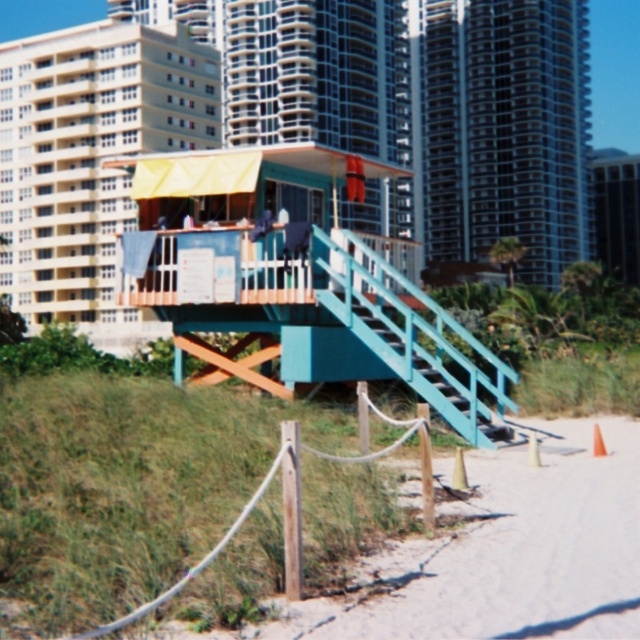
Is teal wooden lifeguard tower at center smaller than teal painted wood stairs at center?

Incorrect, teal wooden lifeguard tower at center is not smaller in size than teal painted wood stairs at center.

Is point (291, 358) farther from camera compared to point (394, 300)?

Yes, it is behind point (394, 300).

Where is `teal wooden lifeguard tower at center`? This screenshot has height=640, width=640. teal wooden lifeguard tower at center is located at coordinates point(296,284).